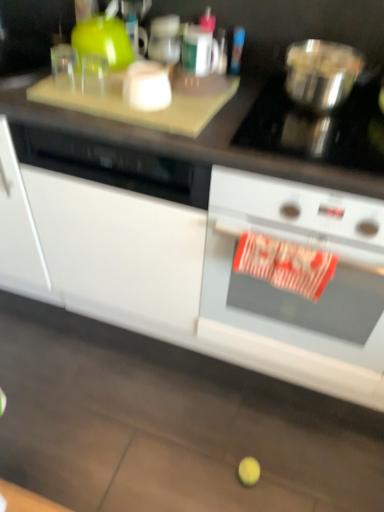
The width and height of the screenshot is (384, 512). In order to click on vacant region above metallic silver bowl at upper right (from a real-world perspective) in this screenshot , I will do `click(326, 56)`.